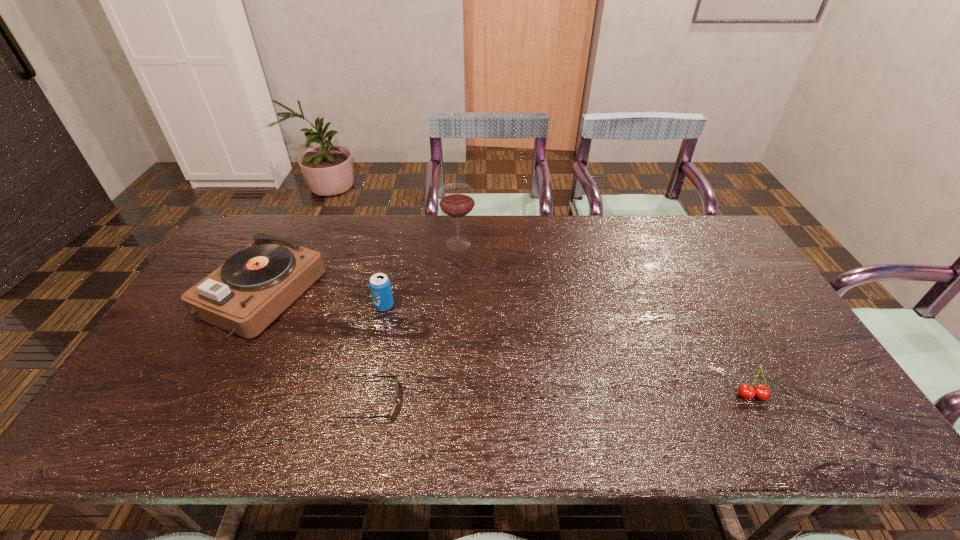
What are the coordinates of `the fourth object from left to right` in the screenshot? It's located at (456, 200).

Locate an element on the screen. This screenshot has width=960, height=540. the tallest object is located at coordinates (456, 200).

Where is `record player`? record player is located at coordinates (244, 295).

Find the location of a particular element. The width and height of the screenshot is (960, 540). soda can is located at coordinates (380, 287).

At what (x,y) coordinates should I click in order to perform the action: click on cherry. Please return your answer as a coordinate pair (x, y). The width and height of the screenshot is (960, 540). Looking at the image, I should click on (762, 392).

Image resolution: width=960 pixels, height=540 pixels. I want to click on the shortest object, so (390, 414).

Locate an element on the screen. This screenshot has height=540, width=960. vacant area situated on the left of the second object from right to left is located at coordinates (330, 244).

Image resolution: width=960 pixels, height=540 pixels. I want to click on free space located on the front of the record player, so click(185, 439).

Locate an element on the screen. Image resolution: width=960 pixels, height=540 pixels. free spot located 0.370m on the right of the soda can is located at coordinates (520, 306).

The image size is (960, 540). What are the coordinates of `vacant area located with the stems of the cherry pointing upwards` in the screenshot? It's located at (767, 426).